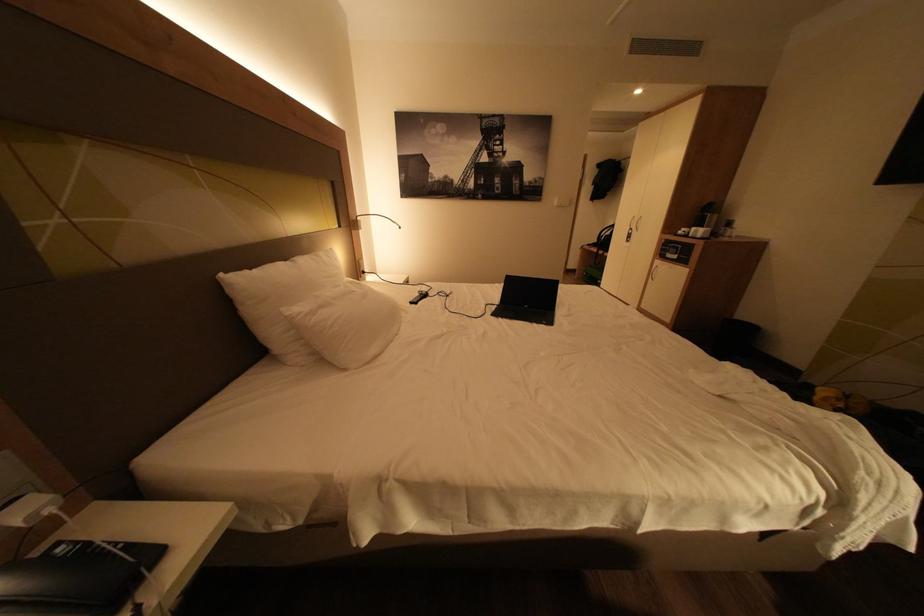
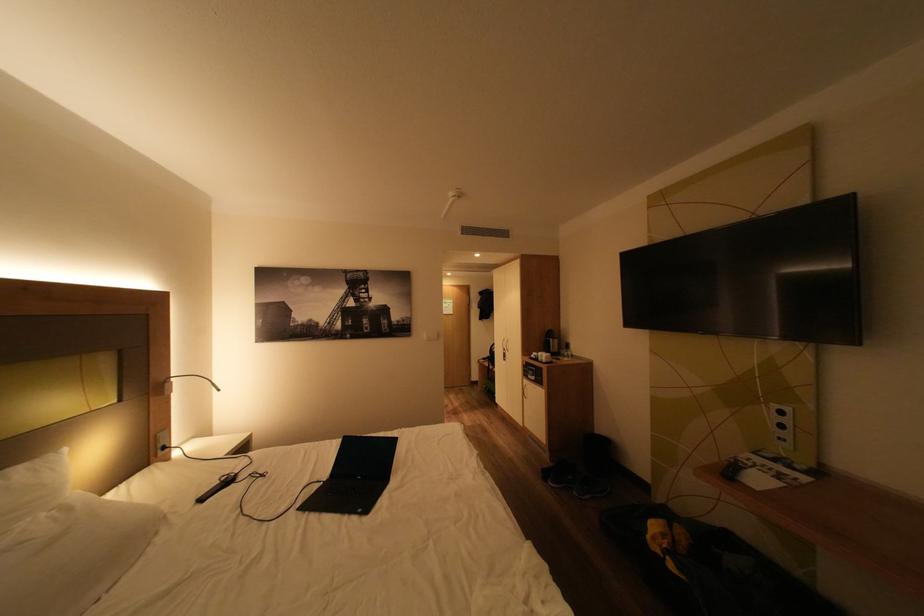
Locate, in the second image, the point that corresponds to pixel 431 293 in the first image.

(235, 479)